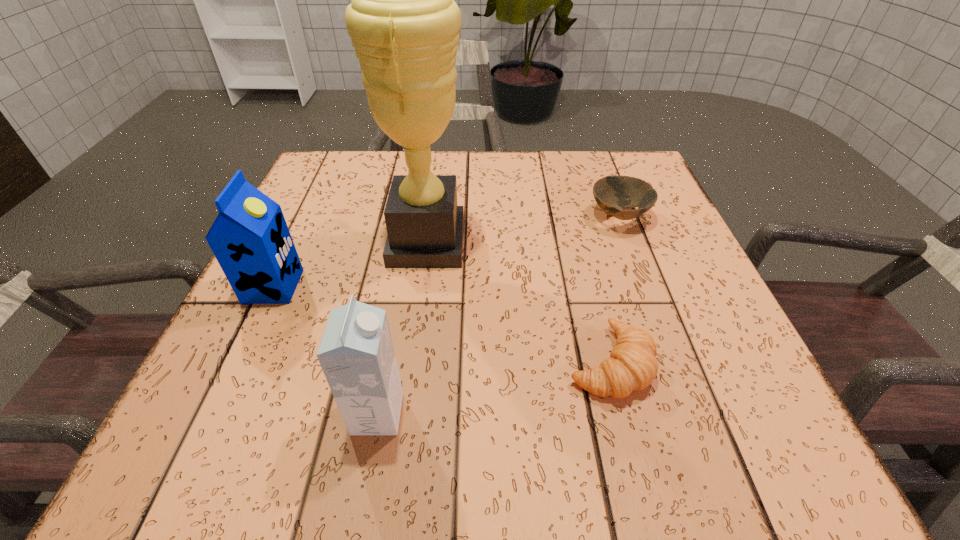
The width and height of the screenshot is (960, 540). I want to click on vacant space at the right edge of the desktop, so click(677, 308).

I want to click on free space at the far left corner of the desktop, so click(359, 173).

In order to click on free point between the tallest object and the nearer carton in this screenshot , I will do `click(402, 328)`.

At what (x,y) coordinates should I click in order to perform the action: click on vacant space that is in between the trophy cup and the bowl. Please return your answer as a coordinate pair (x, y). Looking at the image, I should click on (522, 230).

Locate an element on the screen. This screenshot has width=960, height=540. empty space between the bowl and the tallest object is located at coordinates (522, 230).

At what (x,y) coordinates should I click in order to perform the action: click on free point between the trophy cup and the right carton. Please return your answer as a coordinate pair (x, y). Image resolution: width=960 pixels, height=540 pixels. Looking at the image, I should click on (402, 328).

The width and height of the screenshot is (960, 540). What are the coordinates of `free spot between the crescent roll and the left carton` in the screenshot? It's located at (442, 325).

This screenshot has width=960, height=540. I want to click on unoccupied position between the left carton and the crescent roll, so click(x=442, y=325).

The image size is (960, 540). I want to click on unoccupied position between the nearer carton and the crescent roll, so click(x=493, y=388).

This screenshot has width=960, height=540. What are the coordinates of `free spot between the left carton and the crescent roll` in the screenshot? It's located at (442, 325).